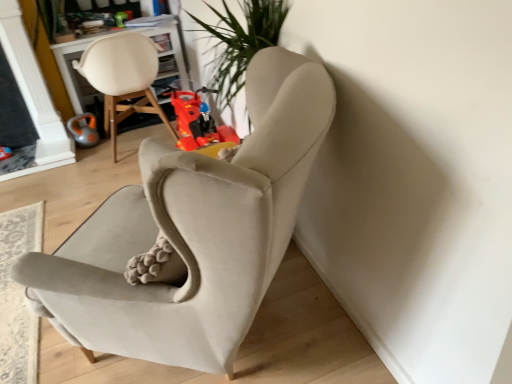
Image resolution: width=512 pixels, height=384 pixels. In order to click on spots to the right of orange rubber toy at left, which is the second toy from right to left in this screenshot , I will do `click(119, 139)`.